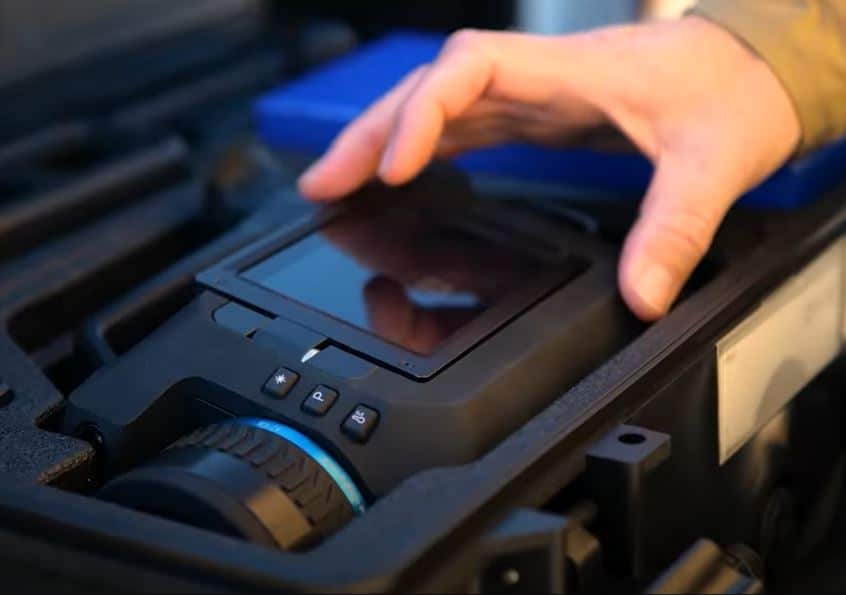
I want to click on glass, so click(438, 275).